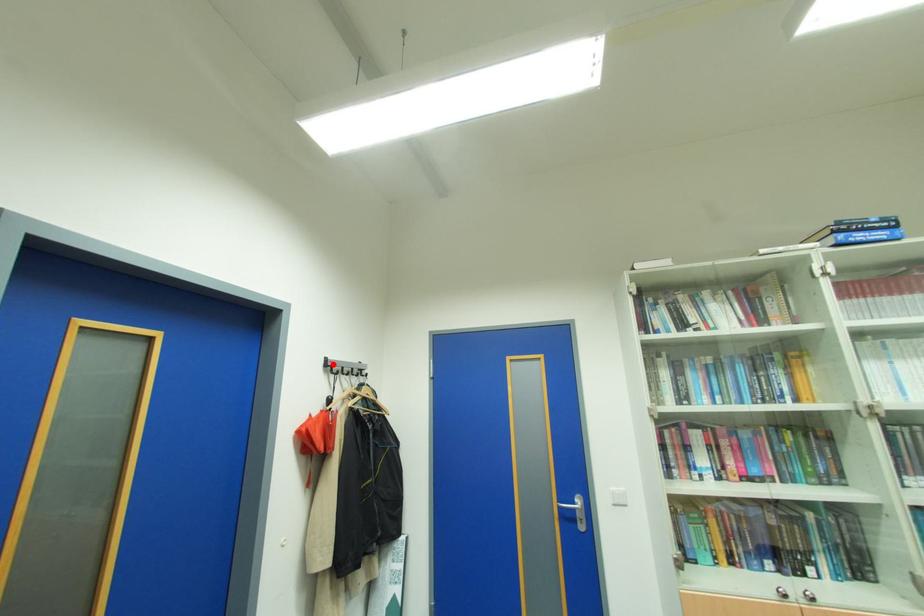
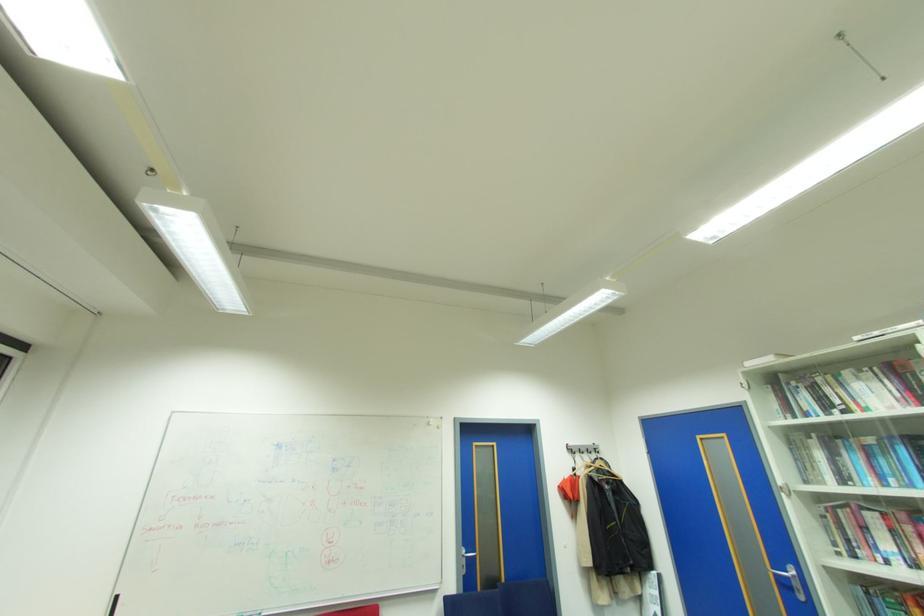
Find the pixel in the second image that matches the highlighted location in the first image.

(573, 448)